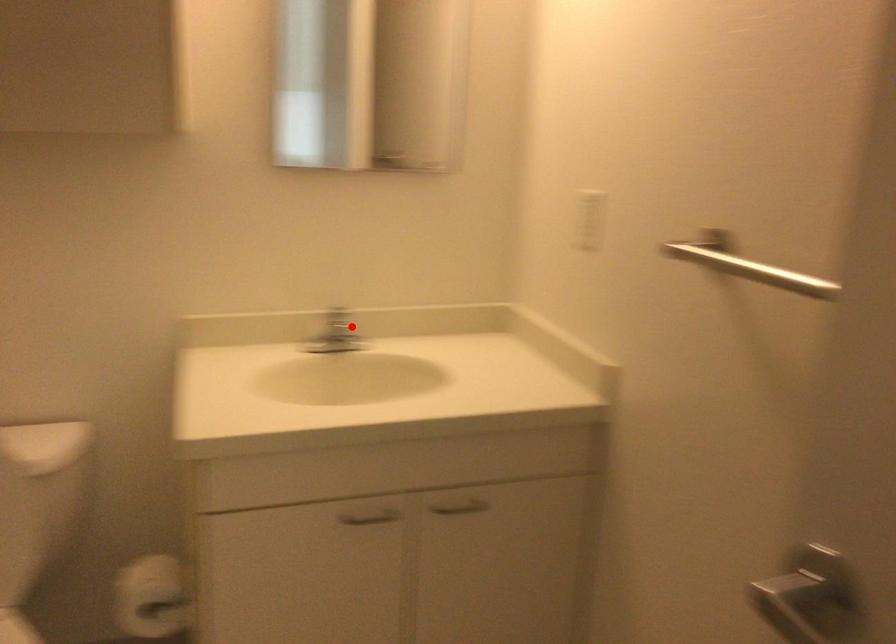
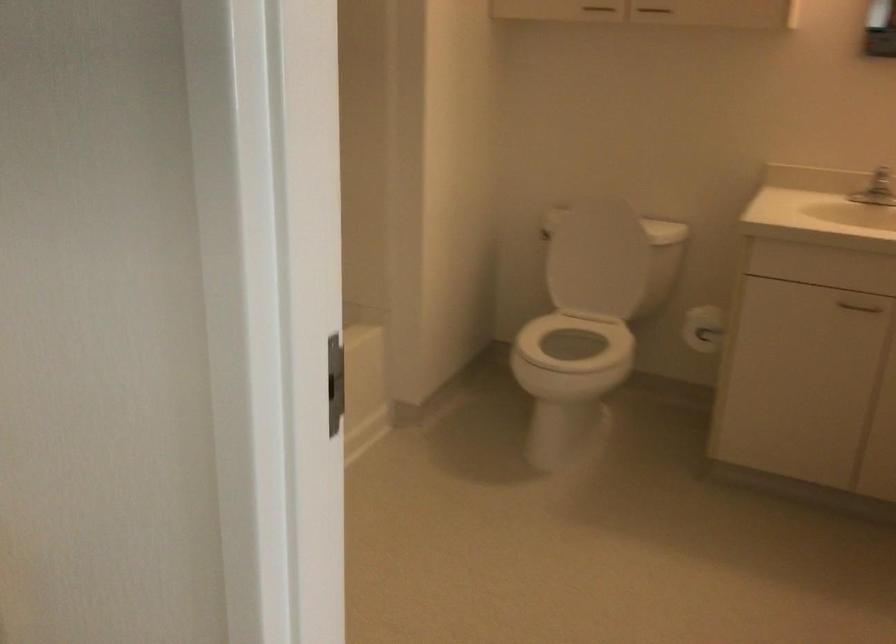
In the second image, find the point that corresponds to the highlighted location in the first image.

(881, 182)